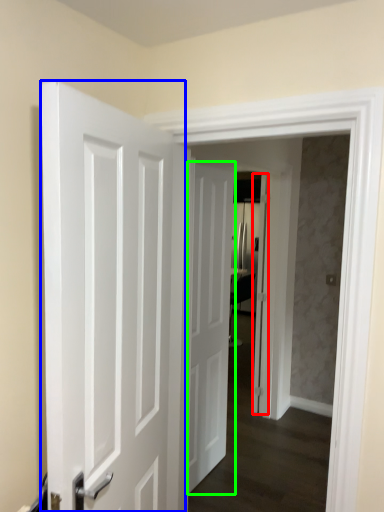
Question: Based on their relative distances, which object is nearer to door (highlighted by a red box)? Choose from door (highlighted by a blue box) and door (highlighted by a green box).

Choices:
 (A) door
 (B) door

Answer: (B)